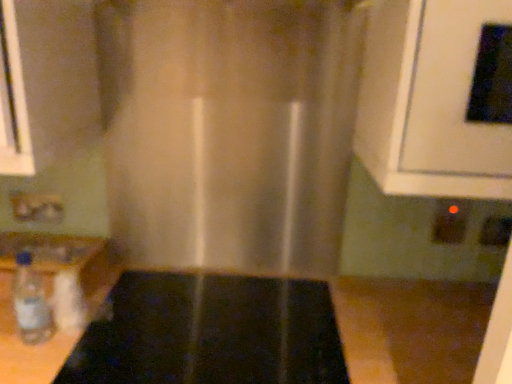
What is the approximate width of matte plastic electric outlet at lower left, the first electric outlet from the left?

matte plastic electric outlet at lower left, the first electric outlet from the left, is 2.16 centimeters wide.

Find the location of a particular element. The height and width of the screenshot is (384, 512). black plastic electric outlet at lower right, the 2th electric outlet positioned from the left is located at coordinates (450, 221).

The image size is (512, 384). Describe the element at coordinates (450, 221) in the screenshot. I see `black plastic electric outlet at lower right, the 2th electric outlet positioned from the left` at that location.

Measure the distance between point [92,343] and camera.

They are 37.80 inches apart.

The width and height of the screenshot is (512, 384). What do you see at coordinates (31, 303) in the screenshot?
I see `clear plastic bottle at lower left` at bounding box center [31, 303].

What is the approximate height of black plastic electric outlet at lower right, the 1th electric outlet in the right-to-left sequence?

black plastic electric outlet at lower right, the 1th electric outlet in the right-to-left sequence, is 3.59 inches tall.

Find the location of a particular element. translucent fabric curtain at center is located at coordinates (229, 131).

Can we say black plastic electric outlet at lower right, which appears as the third electric outlet when viewed from the left, lies outside black plastic electric outlet at lower right, the 2th electric outlet positioned from the left?

Yes, black plastic electric outlet at lower right, which appears as the third electric outlet when viewed from the left, is located beyond the bounds of black plastic electric outlet at lower right, the 2th electric outlet positioned from the left.

Looking at this image, is black plastic electric outlet at lower right, which appears as the third electric outlet when viewed from the left, in contact with black plastic electric outlet at lower right, the 2th electric outlet positioned from the left?

No, black plastic electric outlet at lower right, which appears as the third electric outlet when viewed from the left, is not touching black plastic electric outlet at lower right, the 2th electric outlet positioned from the left.

Between black plastic electric outlet at lower right, which appears as the third electric outlet when viewed from the left, and black plastic electric outlet at lower right, the 2th electric outlet positioned from the left, which one appears on the left side from the viewer's perspective?

black plastic electric outlet at lower right, the 2th electric outlet positioned from the left, is more to the left.

How many degrees apart are the facing directions of black plastic electric outlet at lower right, the 1th electric outlet in the right-to-left sequence, and black plastic electric outlet at lower right, which is the 2th electric outlet from right to left?

They differ by 1.03 degrees in their facing directions.

Could you tell me if black plastic electric outlet at lower right, which is the 2th electric outlet from right to left, is turned towards black glass stove at center?

No, black plastic electric outlet at lower right, which is the 2th electric outlet from right to left, is not facing towards black glass stove at center.

From the image's perspective, is black plastic electric outlet at lower right, the 2th electric outlet positioned from the left, below black glass stove at center?

Incorrect, from the image's perspective, black plastic electric outlet at lower right, the 2th electric outlet positioned from the left, is higher than black glass stove at center.

Between black plastic electric outlet at lower right, the 2th electric outlet positioned from the left, and black glass stove at center, which one has smaller size?

With smaller size is black plastic electric outlet at lower right, the 2th electric outlet positioned from the left.

Considering the sizes of black plastic electric outlet at lower right, the 2th electric outlet positioned from the left, and black glass stove at center in the image, is black plastic electric outlet at lower right, the 2th electric outlet positioned from the left, taller or shorter than black glass stove at center?

Clearly, black plastic electric outlet at lower right, the 2th electric outlet positioned from the left, is taller compared to black glass stove at center.

Which is behind, point (15, 289) or point (439, 19)?

The point (15, 289) is farther from the camera.

Considering the relative positions of clear plastic bottle at lower left and black glossy oven at upper right in the image provided, is clear plastic bottle at lower left to the left of black glossy oven at upper right from the viewer's perspective?

Yes.

The image size is (512, 384). I want to click on bottle that is on the left side of black glossy oven at upper right, so click(31, 303).

Based on the photo, which of these two, clear plastic bottle at lower left or black glossy oven at upper right, is wider?

black glossy oven at upper right.

Consider the image. Can you confirm if translucent fabric curtain at center is positioned to the left of black plastic electric outlet at lower right, the 1th electric outlet in the right-to-left sequence?

Yes, translucent fabric curtain at center is to the left of black plastic electric outlet at lower right, the 1th electric outlet in the right-to-left sequence.

From the image's perspective, which is above, translucent fabric curtain at center or black plastic electric outlet at lower right, the 1th electric outlet in the right-to-left sequence?

translucent fabric curtain at center.

Considering the sizes of objects translucent fabric curtain at center and black plastic electric outlet at lower right, which appears as the third electric outlet when viewed from the left, in the image provided, who is thinner, translucent fabric curtain at center or black plastic electric outlet at lower right, which appears as the third electric outlet when viewed from the left,?

Thinner between the two is black plastic electric outlet at lower right, which appears as the third electric outlet when viewed from the left.

Is translucent fabric curtain at center positioned far away from black plastic electric outlet at lower right, which appears as the third electric outlet when viewed from the left?

translucent fabric curtain at center is actually quite close to black plastic electric outlet at lower right, which appears as the third electric outlet when viewed from the left.

Which object is further away from the camera, black plastic electric outlet at lower right, the 1th electric outlet in the right-to-left sequence, or matte plastic electric outlet at lower left, the first electric outlet from the left?

matte plastic electric outlet at lower left, the first electric outlet from the left, is more distant.

Which is more to the left, black plastic electric outlet at lower right, which appears as the third electric outlet when viewed from the left, or matte plastic electric outlet at lower left, which is the third electric outlet in right-to-left order?

Positioned to the left is matte plastic electric outlet at lower left, which is the third electric outlet in right-to-left order.

From a real-world perspective, who is located higher, black plastic electric outlet at lower right, which appears as the third electric outlet when viewed from the left, or matte plastic electric outlet at lower left, which is the third electric outlet in right-to-left order?

In real-world perspective, matte plastic electric outlet at lower left, which is the third electric outlet in right-to-left order, is above.

How much distance is there between black plastic electric outlet at lower right, the 1th electric outlet in the right-to-left sequence, and matte plastic electric outlet at lower left, the first electric outlet from the left?

1.28 meters.

Which object is further away from the camera, matte plastic electric outlet at lower left, the first electric outlet from the left, or black plastic electric outlet at lower right, the 1th electric outlet in the right-to-left sequence?

Positioned behind is matte plastic electric outlet at lower left, the first electric outlet from the left.

Can you confirm if matte plastic electric outlet at lower left, the first electric outlet from the left, is thinner than black plastic electric outlet at lower right, which appears as the third electric outlet when viewed from the left?

No, matte plastic electric outlet at lower left, the first electric outlet from the left, is not thinner than black plastic electric outlet at lower right, which appears as the third electric outlet when viewed from the left.

From the image's perspective, is matte plastic electric outlet at lower left, the first electric outlet from the left, below black plastic electric outlet at lower right, the 1th electric outlet in the right-to-left sequence?

No, from the image's perspective, matte plastic electric outlet at lower left, the first electric outlet from the left, is not below black plastic electric outlet at lower right, the 1th electric outlet in the right-to-left sequence.

From a real-world perspective, between matte plastic electric outlet at lower left, which is the third electric outlet in right-to-left order, and translucent fabric curtain at center, who is vertically lower?

In real-world perspective, matte plastic electric outlet at lower left, which is the third electric outlet in right-to-left order, is lower.

Is matte plastic electric outlet at lower left, which is the third electric outlet in right-to-left order, turned away from translucent fabric curtain at center?

That's not correct — matte plastic electric outlet at lower left, which is the third electric outlet in right-to-left order, is not looking away from translucent fabric curtain at center.

Does matte plastic electric outlet at lower left, the first electric outlet from the left, have a lesser height compared to translucent fabric curtain at center?

Yes.

Based on the photo, from the image's perspective, between matte plastic electric outlet at lower left, which is the third electric outlet in right-to-left order, and translucent fabric curtain at center, who is located below?

matte plastic electric outlet at lower left, which is the third electric outlet in right-to-left order, appears lower in the image.

Where is `the 2nd electric outlet above the black plastic electric outlet at lower right, which appears as the third electric outlet when viewed from the left (from a real-world perspective)`? This screenshot has width=512, height=384. the 2nd electric outlet above the black plastic electric outlet at lower right, which appears as the third electric outlet when viewed from the left (from a real-world perspective) is located at coordinates (450, 221).

Locate an element on the screen. electric outlet that is the 1st one when counting backward from the black glass stove at center is located at coordinates (450, 221).

Estimate the real-world distances between objects in this image. Which object is closer to black glossy oven at upper right, translucent fabric curtain at center or clear plastic bottle at lower left?

The object closer to black glossy oven at upper right is translucent fabric curtain at center.

Considering their positions, is black glass stove at center positioned closer to black plastic electric outlet at lower right, which appears as the third electric outlet when viewed from the left, than black glossy oven at upper right?

Among the two, black glossy oven at upper right is located nearer to black plastic electric outlet at lower right, which appears as the third electric outlet when viewed from the left.

Considering their positions, is black glossy oven at upper right positioned closer to black plastic electric outlet at lower right, which is the 2th electric outlet from right to left, than translucent fabric curtain at center?

black glossy oven at upper right is positioned closer to the anchor black plastic electric outlet at lower right, which is the 2th electric outlet from right to left.

In the scene shown: Estimate the real-world distances between objects in this image. Which object is further from black glass stove at center, black glossy oven at upper right or clear plastic bottle at lower left?

black glossy oven at upper right.

Considering their positions, is black plastic electric outlet at lower right, which appears as the third electric outlet when viewed from the left, positioned closer to matte plastic electric outlet at lower left, which is the third electric outlet in right-to-left order, than clear plastic bottle at lower left?

clear plastic bottle at lower left is closer to matte plastic electric outlet at lower left, which is the third electric outlet in right-to-left order.

Considering their positions, is clear plastic bottle at lower left positioned closer to translucent fabric curtain at center than black plastic electric outlet at lower right, which is the 2th electric outlet from right to left?

Based on the image, clear plastic bottle at lower left appears to be nearer to translucent fabric curtain at center.

When comparing their distances from black plastic electric outlet at lower right, the 2th electric outlet positioned from the left, does clear plastic bottle at lower left or translucent fabric curtain at center seem further?

Among the two, clear plastic bottle at lower left is located further to black plastic electric outlet at lower right, the 2th electric outlet positioned from the left.

When comparing their distances from black plastic electric outlet at lower right, the 2th electric outlet positioned from the left, does black plastic electric outlet at lower right, the 1th electric outlet in the right-to-left sequence, or translucent fabric curtain at center seem closer?

black plastic electric outlet at lower right, the 1th electric outlet in the right-to-left sequence, lies closer to black plastic electric outlet at lower right, the 2th electric outlet positioned from the left, than the other object.

Find the location of a particular element. electric outlet between black glass stove at center and black plastic electric outlet at lower right, which appears as the third electric outlet when viewed from the left, from left to right is located at coordinates (450, 221).

Where is `bottle between translucent fabric curtain at center and black glass stove at center in the up-down direction`? bottle between translucent fabric curtain at center and black glass stove at center in the up-down direction is located at coordinates (31, 303).

Image resolution: width=512 pixels, height=384 pixels. What are the coordinates of `oven situated between translucent fabric curtain at center and black plastic electric outlet at lower right, the 2th electric outlet positioned from the left, from left to right` in the screenshot? It's located at (430, 101).

Locate an element on the screen. The image size is (512, 384). curtain situated between clear plastic bottle at lower left and black plastic electric outlet at lower right, which is the 2th electric outlet from right to left, from left to right is located at coordinates (229, 131).